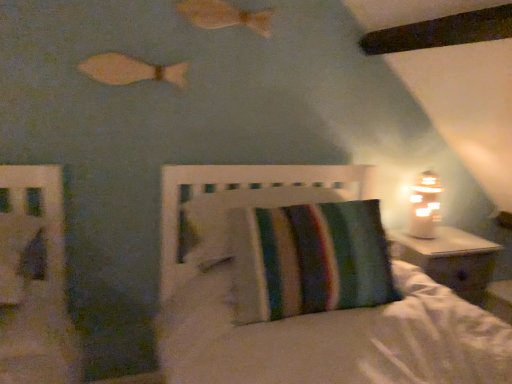
What do you see at coordinates (302, 291) in the screenshot? I see `striped fabric pillow at center` at bounding box center [302, 291].

Describe the element at coordinates (224, 15) in the screenshot. I see `wooden fish at upper center, the 1th fish when ordered from right to left` at that location.

Identify the location of striped fabric headboard at center. The width and height of the screenshot is (512, 384). (243, 198).

You are a GUI agent. You are given a task and a screenshot of the screen. Output one action in this format:
    pyautogui.click(x=<x>, y=<y>)
    Task: Click on the white frosted glass table lamp at right
    This screenshot has height=384, width=512.
    Given the screenshot: What is the action you would take?
    pyautogui.click(x=424, y=206)

Consider the image. Between striped fabric pillow at center and wooden fish at upper left, positioned as the 1th fish in bottom-to-top order, which one is positioned behind?

wooden fish at upper left, positioned as the 1th fish in bottom-to-top order.

Considering the positions of points (415, 292) and (126, 69), is point (415, 292) farther from camera compared to point (126, 69)?

No, (415, 292) is closer to viewer.

Locate an element on the screen. fish that is the 2nd one when counting leftward from the striped fabric pillow at center is located at coordinates (131, 70).

In the scene shown: Is striped fabric pillow at center placed right next to wooden fish at upper left, placed as the 2th fish when sorted from right to left?

striped fabric pillow at center and wooden fish at upper left, placed as the 2th fish when sorted from right to left, are clearly separated.

From a real-world perspective, is wooden fish at upper left, which is the first fish from left to right, above or below striped fabric headboard at center?

In terms of real-world spatial position, wooden fish at upper left, which is the first fish from left to right, is above striped fabric headboard at center.

Looking at their sizes, would you say wooden fish at upper left, placed as the 2th fish when sorted from right to left, is wider or thinner than striped fabric headboard at center?

Considering their sizes, wooden fish at upper left, placed as the 2th fish when sorted from right to left, looks slimmer than striped fabric headboard at center.

Between wooden fish at upper left, placed as the 2th fish when sorted from right to left, and striped fabric headboard at center, which one appears on the right side from the viewer's perspective?

Positioned to the right is striped fabric headboard at center.

Does striped fabric headboard at center have a larger size compared to wooden fish at upper left, the second fish viewed from the top?

Indeed, striped fabric headboard at center has a larger size compared to wooden fish at upper left, the second fish viewed from the top.

Is point (257, 181) closer or farther from the camera than point (135, 69)?

Point (257, 181) appears to be farther away from the viewer than point (135, 69).

Is wooden fish at upper center, positioned as the first fish in top-to-bottom order, at the back of white frosted glass table lamp at right?

No, white frosted glass table lamp at right is not facing the opposite direction of wooden fish at upper center, positioned as the first fish in top-to-bottom order.

How much distance is there between white frosted glass table lamp at right and wooden fish at upper center, the 2th fish from the bottom?

white frosted glass table lamp at right is 3.66 feet from wooden fish at upper center, the 2th fish from the bottom.

From a real-world perspective, which is physically above, white frosted glass table lamp at right or wooden fish at upper center, the 2th fish from the bottom?

wooden fish at upper center, the 2th fish from the bottom, is physically above.

Is white frosted glass table lamp at right positioned beyond the bounds of wooden fish at upper center, the 1th fish when ordered from right to left?

white frosted glass table lamp at right lies outside wooden fish at upper center, the 1th fish when ordered from right to left,'s area.

Looking at their sizes, would you say wooden fish at upper left, which is the first fish from left to right, is wider or thinner than wooden fish at upper center, positioned as the first fish in top-to-bottom order?

wooden fish at upper left, which is the first fish from left to right, is thinner than wooden fish at upper center, positioned as the first fish in top-to-bottom order.

From a real-world perspective, between wooden fish at upper left, placed as the 2th fish when sorted from right to left, and wooden fish at upper center, the 1th fish when ordered from right to left, who is vertically lower?

In real-world perspective, wooden fish at upper left, placed as the 2th fish when sorted from right to left, is lower.

Between point (127, 68) and point (193, 10), which one is positioned in front?

The point (127, 68) is closer.

Considering the relative sizes of wooden fish at upper left, the second fish viewed from the top, and wooden fish at upper center, positioned as the first fish in top-to-bottom order, in the image provided, is wooden fish at upper left, the second fish viewed from the top, bigger than wooden fish at upper center, positioned as the first fish in top-to-bottom order,?

No, wooden fish at upper left, the second fish viewed from the top, is not bigger than wooden fish at upper center, positioned as the first fish in top-to-bottom order.

In the scene shown: Is wooden fish at upper center, positioned as the first fish in top-to-bottom order, positioned behind striped fabric pillow at center?

Yes, it is.

Looking at this image, which is farther from the camera, (x=190, y=0) or (x=252, y=344)?

The point (x=190, y=0) is farther from the camera.

From the image's perspective, relative to striped fabric pillow at center, is wooden fish at upper center, positioned as the 2th fish in left-to-right order, above or below?

wooden fish at upper center, positioned as the 2th fish in left-to-right order, is situated higher than striped fabric pillow at center in the image.

How different are the orientations of wooden fish at upper center, the 1th fish when ordered from right to left, and striped fabric pillow at center in degrees?

wooden fish at upper center, the 1th fish when ordered from right to left, and striped fabric pillow at center are facing 86.9 degrees away from each other.

Is wooden fish at upper left, the second fish viewed from the top, facing away from striped fabric pillow at center?

That's not correct — wooden fish at upper left, the second fish viewed from the top, is not looking away from striped fabric pillow at center.

This screenshot has width=512, height=384. I want to click on bed lying below the wooden fish at upper left, placed as the 2th fish when sorted from right to left (from the image's perspective), so click(x=302, y=291).

Is wooden fish at upper left, which is the first fish from left to right, at the left side of striped fabric pillow at center?

Yes.

Is wooden fish at upper left, which is the first fish from left to right, not close to striped fabric pillow at center?

No, wooden fish at upper left, which is the first fish from left to right, is not far from striped fabric pillow at center.

Image resolution: width=512 pixels, height=384 pixels. In order to click on the 1st fish behind when counting from the striped fabric pillow at center in this screenshot , I will do `click(131, 70)`.

At what (x,y) coordinates should I click in order to perform the action: click on headboard that appears below the wooden fish at upper left, placed as the 2th fish when sorted from right to left (from a real-world perspective). Please return your answer as a coordinate pair (x, y). Image resolution: width=512 pixels, height=384 pixels. Looking at the image, I should click on (243, 198).

Which object lies nearer to the anchor point striped fabric headboard at center, wooden fish at upper center, the 2th fish from the bottom, or white frosted glass table lamp at right?

white frosted glass table lamp at right is positioned closer to the anchor striped fabric headboard at center.

Based on their spatial positions, is white frosted glass table lamp at right or striped fabric pillow at center closer to striped fabric headboard at center?

striped fabric pillow at center.

From the image, which object appears to be farther from wooden fish at upper center, positioned as the 2th fish in left-to-right order, white frosted glass table lamp at right or striped fabric pillow at center?

white frosted glass table lamp at right.

Which object lies further to the anchor point striped fabric headboard at center, white frosted glass table lamp at right or wooden fish at upper center, the 2th fish from the bottom?

wooden fish at upper center, the 2th fish from the bottom, lies further to striped fabric headboard at center than the other object.

Considering their positions, is wooden fish at upper left, the second fish viewed from the top, positioned closer to striped fabric pillow at center than striped fabric headboard at center?

striped fabric headboard at center is positioned closer to the anchor striped fabric pillow at center.

Estimate the real-world distances between objects in this image. Which object is further from white frosted glass table lamp at right, striped fabric pillow at center or striped fabric headboard at center?

striped fabric pillow at center is further to white frosted glass table lamp at right.

Looking at the image, which one is located closer to white frosted glass table lamp at right, wooden fish at upper left, placed as the 2th fish when sorted from right to left, or striped fabric headboard at center?

The object closer to white frosted glass table lamp at right is striped fabric headboard at center.

Considering their positions, is wooden fish at upper center, the 2th fish from the bottom, positioned closer to wooden fish at upper left, which is the first fish from left to right, than striped fabric pillow at center?

wooden fish at upper center, the 2th fish from the bottom, is closer to wooden fish at upper left, which is the first fish from left to right.

Locate an element on the screen. Image resolution: width=512 pixels, height=384 pixels. bed situated between wooden fish at upper left, the second fish viewed from the top, and white frosted glass table lamp at right from left to right is located at coordinates (302, 291).

Where is `headboard located between wooden fish at upper center, the 1th fish when ordered from right to left, and white frosted glass table lamp at right in the left-right direction`? Image resolution: width=512 pixels, height=384 pixels. headboard located between wooden fish at upper center, the 1th fish when ordered from right to left, and white frosted glass table lamp at right in the left-right direction is located at coordinates (243, 198).

This screenshot has height=384, width=512. I want to click on headboard between wooden fish at upper left, positioned as the 1th fish in bottom-to-top order, and white frosted glass table lamp at right from left to right, so click(x=243, y=198).

The height and width of the screenshot is (384, 512). Find the location of `headboard between striped fabric pillow at center and white frosted glass table lamp at right in the front-back direction`. headboard between striped fabric pillow at center and white frosted glass table lamp at right in the front-back direction is located at coordinates (243, 198).